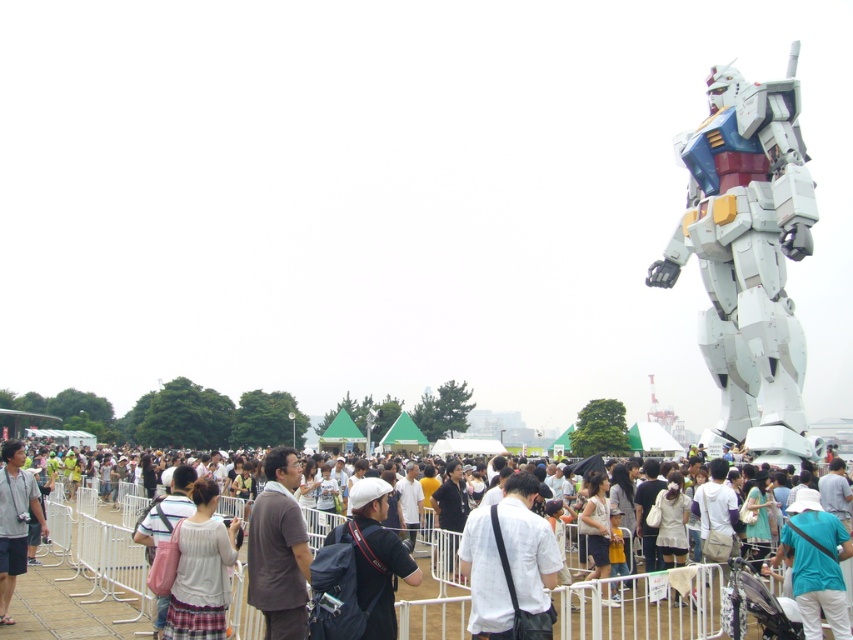
Describe the element at coordinates (747, 257) in the screenshot. I see `white metallic robot at upper right` at that location.

Where is `white metallic robot at upper right`? white metallic robot at upper right is located at coordinates (747, 257).

Does point (738, 84) come behind point (833, 596)?

Yes, point (738, 84) is behind point (833, 596).

Locate an element on the screen. The image size is (853, 640). white metallic robot at upper right is located at coordinates (747, 257).

Is point (308, 576) less distant than point (817, 541)?

Yes, it is in front of point (817, 541).

Looking at this image, can you confirm if brown matte shirt at center is thinner than teal fabric shirt at lower right?

No, brown matte shirt at center is not thinner than teal fabric shirt at lower right.

I want to click on brown matte shirt at center, so click(x=277, y=548).

Which of these two, brown matte shirt at center or white matte cap at center, stands shorter?

Standing shorter between the two is white matte cap at center.

How much distance is there between brown matte shirt at center and white matte cap at center?

5.28 meters

This screenshot has width=853, height=640. Describe the element at coordinates (277, 548) in the screenshot. I see `brown matte shirt at center` at that location.

I want to click on brown matte shirt at center, so click(x=277, y=548).